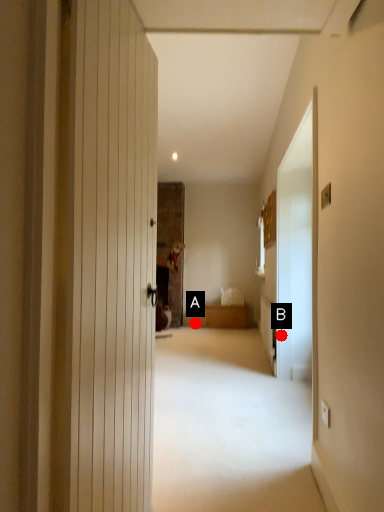
Question: Two points are circled on the image, labeled by A and B beside each circle. Which point is closer to the camera?

Choices:
 (A) A is closer
 (B) B is closer

Answer: (B)